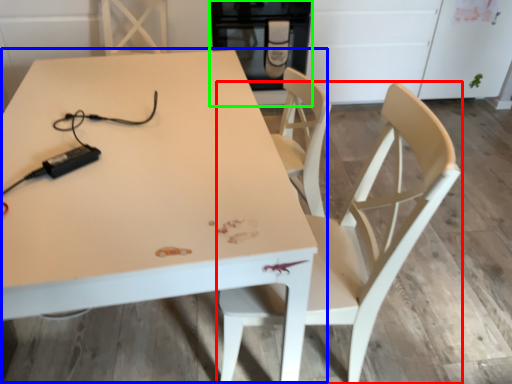
Question: Which is farther away from chair (highlighted by a red box)? table (highlighted by a blue box) or appliance (highlighted by a green box)?

Choices:
 (A) table
 (B) appliance

Answer: (B)